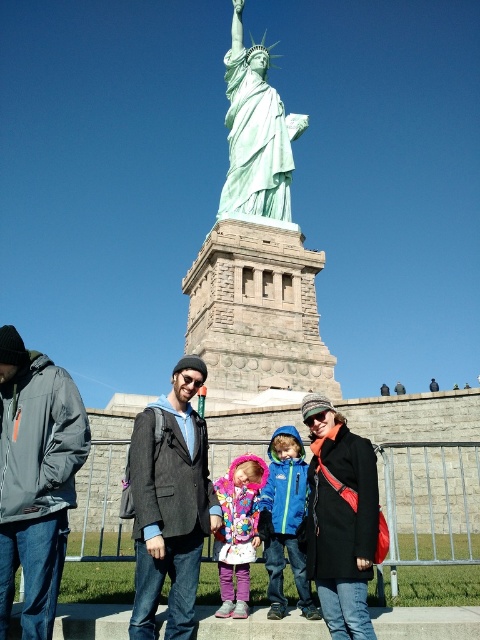
You are standing behind the gray softshell jacket at left and want to see the Statue of Liberty clearly. Can you move forward without stepping on the blue fleece jacket at center?

The gray softshell jacket at left is in front of the blue fleece jacket at center, so yes, you can move forward without stepping on the blue fleece jacket at center as there is space between them.

You are a photographer trying to capture a group photo of the gray softshell jacket at left and the blue fleece jacket at center. Since you want to ensure both subjects are in focus, you need to know which jacket is wider to adjust your camera settings. Based on the scene, which jacket has a greater width?

The gray softshell jacket at left has a greater width than the blue fleece jacket at center.